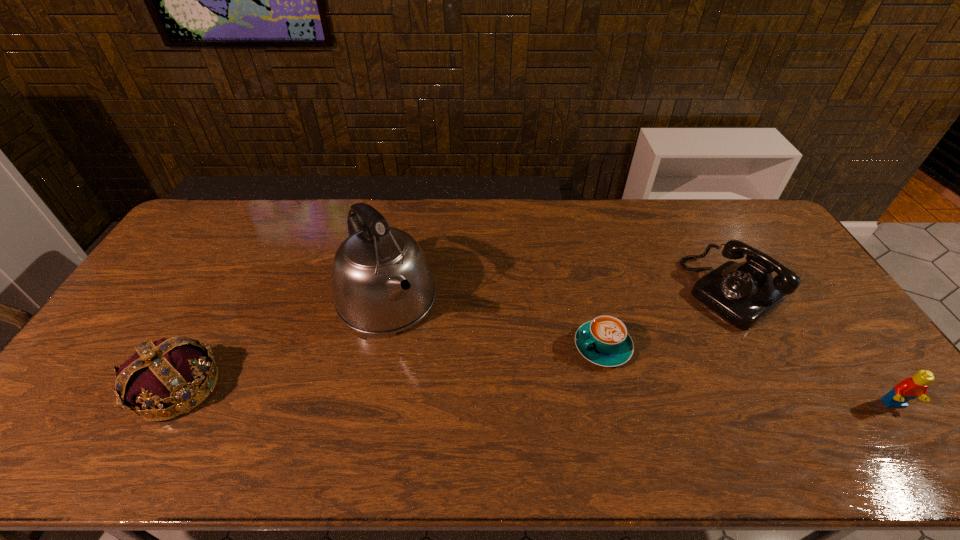
Identify the location of crown. The width and height of the screenshot is (960, 540). tap(180, 372).

Find the location of a particular element. The height and width of the screenshot is (540, 960). the fourth tallest object is located at coordinates (910, 388).

In order to click on the rightmost object in this screenshot , I will do `click(910, 388)`.

This screenshot has height=540, width=960. Find the location of `cappuccino`. cappuccino is located at coordinates (604, 341).

Identify the location of the shortest object. (604, 341).

Where is `the fourth object from left to right`? The width and height of the screenshot is (960, 540). the fourth object from left to right is located at coordinates (744, 293).

This screenshot has height=540, width=960. I want to click on the second object from left to right, so click(x=382, y=284).

Where is `the tallest object`? the tallest object is located at coordinates (382, 284).

Locate an element on the screen. The height and width of the screenshot is (540, 960). vacant area situated 0.100m on the left of the crown is located at coordinates (99, 388).

The width and height of the screenshot is (960, 540). I want to click on vacant area situated with the handle on the right side of the shortest object, so (x=547, y=377).